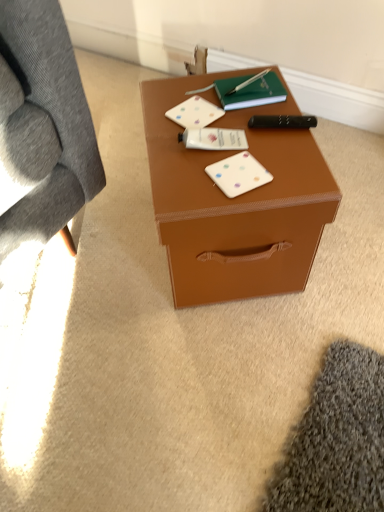
At what (x,y) coordinates should I click in order to perform the action: click on free spot behind white matte card game at center, the first card game in the back-to-front sequence. Please return your answer as a coordinate pair (x, y). The height and width of the screenshot is (512, 384). Looking at the image, I should click on (183, 91).